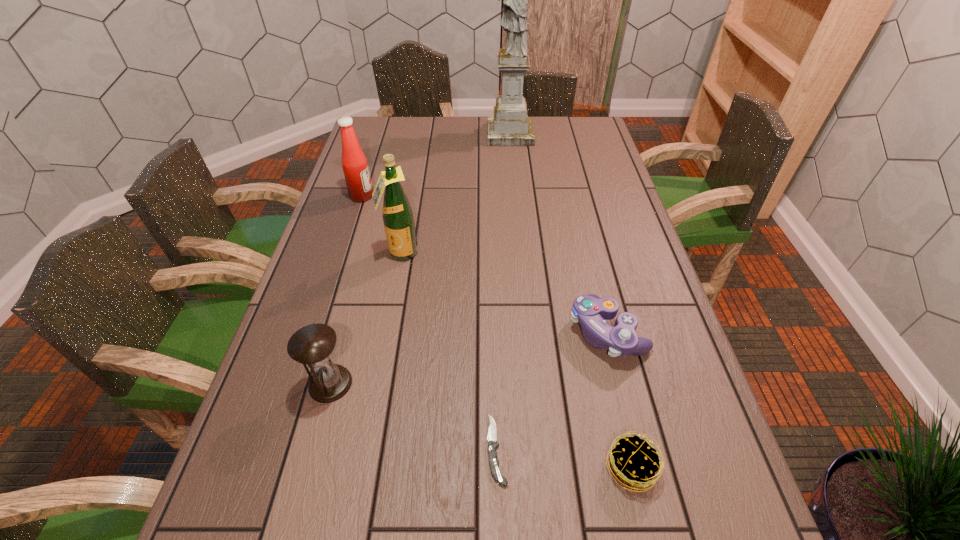
This screenshot has width=960, height=540. In order to click on vacant space situated 0.330m on the front-facing side of the sculpture in this screenshot , I will do `click(402, 134)`.

Locate an element on the screen. The height and width of the screenshot is (540, 960). blank space located on the front-facing side of the sculpture is located at coordinates (438, 134).

Identify the location of free region located 0.200m on the front-facing side of the sculpture. (436, 134).

Where is `free spot located 0.150m on the front-facing side of the liquor`? Image resolution: width=960 pixels, height=540 pixels. free spot located 0.150m on the front-facing side of the liquor is located at coordinates (391, 306).

Identify the location of vacant space located 0.160m on the front-facing side of the sixth nearest object. (423, 196).

Where is `vacant space located on the back of the fourth shortest object`? The height and width of the screenshot is (540, 960). vacant space located on the back of the fourth shortest object is located at coordinates (348, 320).

The image size is (960, 540). In order to click on vacant area situated 0.320m on the left of the control in this screenshot , I will do `click(434, 332)`.

Identify the location of vacant area situated 0.260m on the back of the patty. The width and height of the screenshot is (960, 540). (600, 334).

You are a GUI agent. You are given a task and a screenshot of the screen. Output one action in this format:
    pyautogui.click(x=<x>, y=<y>)
    Task: Click on the blank area located 0.330m on the back of the shortest object
    
    Given the screenshot: What is the action you would take?
    pyautogui.click(x=492, y=294)

This screenshot has width=960, height=540. I want to click on object located in the far edge section of the desktop, so click(x=510, y=126).